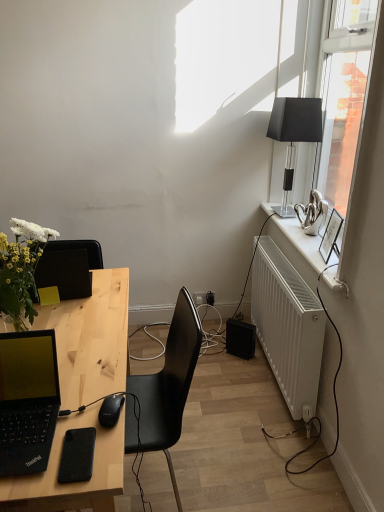
Where is `vacant area on the back side of black matte laptop at left`? The image size is (384, 512). vacant area on the back side of black matte laptop at left is located at coordinates (91, 372).